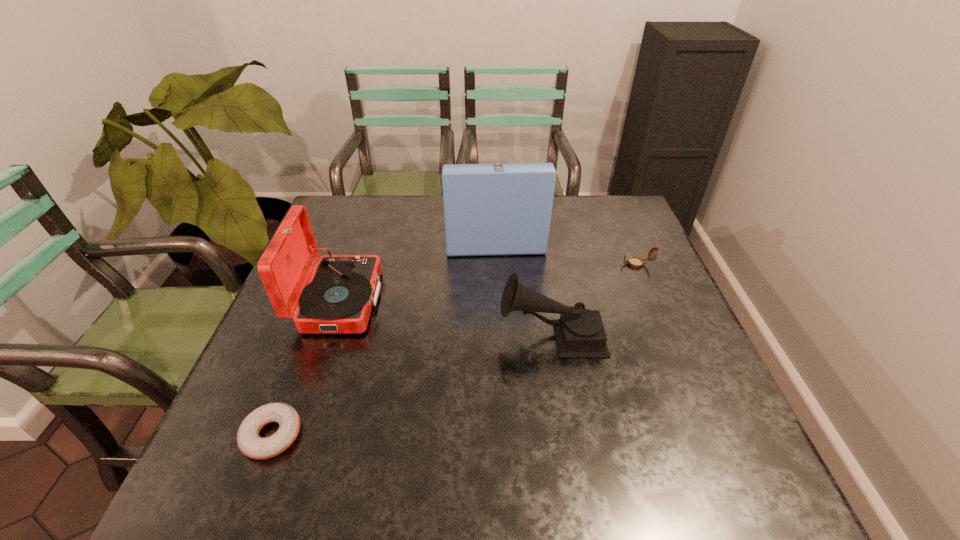
Locate an element on the screen. vacant space located on the front-facing side of the fourth shortest object is located at coordinates (458, 300).

The width and height of the screenshot is (960, 540). I want to click on vacant space located 0.100m from the horn of the shortest phonograph_record, so click(x=457, y=335).

Locate an element on the screen. The image size is (960, 540). vacant space located 0.250m from the horn of the shortest phonograph_record is located at coordinates (393, 335).

Where is `free space located 0.230m from the horn of the shortest phonograph_record`? free space located 0.230m from the horn of the shortest phonograph_record is located at coordinates (401, 335).

Where is `vacant space located 0.260m on the face of the compass`? vacant space located 0.260m on the face of the compass is located at coordinates (528, 264).

This screenshot has height=540, width=960. I want to click on free point located 0.130m on the face of the compass, so click(x=574, y=264).

I want to click on vacant area situated on the face of the compass, so click(x=564, y=264).

The height and width of the screenshot is (540, 960). In order to click on vacant area situated 0.070m on the right of the shortest object in this screenshot , I will do `click(338, 435)`.

Locate an element on the screen. The image size is (960, 540). object at the far edge is located at coordinates (495, 209).

What are the coordinates of `object present at the near edge` in the screenshot? It's located at (249, 442).